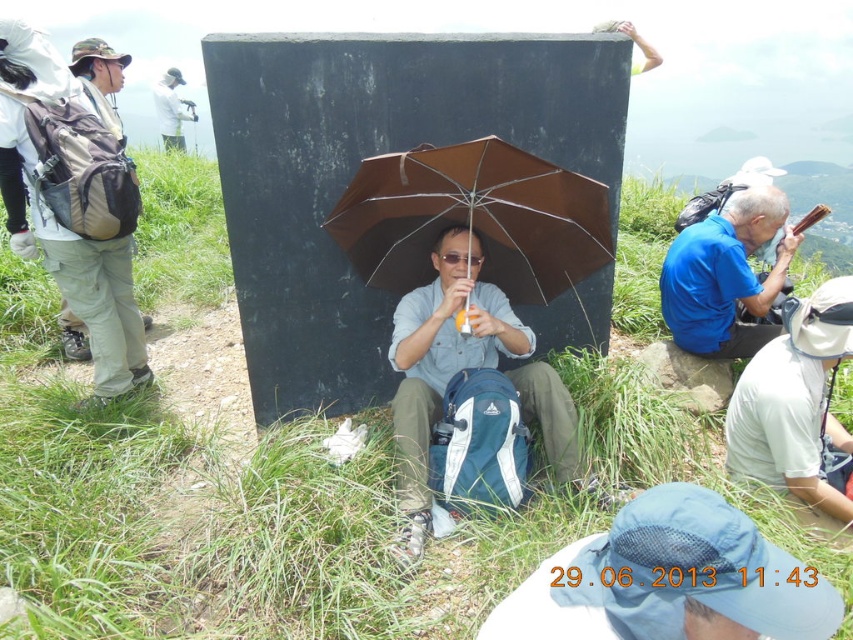
Question: Is brown matte umbrella at center thinner than white fabric camera at upper left?

Choices:
 (A) no
 (B) yes

Answer: (A)

Question: Which point is closer to the camera taking this photo?

Choices:
 (A) (419, 388)
 (B) (172, 138)

Answer: (A)

Question: Can you confirm if brown matte umbrella at center is wider than white fabric camera at upper left?

Choices:
 (A) yes
 (B) no

Answer: (A)

Question: Considering the real-world distances, which object is farthest from the white fabric hat at lower right?

Choices:
 (A) matte blue backpack at center
 (B) white fabric camera at upper left
 (C) blue fabric shirt at center
 (D) brown matte umbrella at center

Answer: (B)

Question: Is matte blue backpack at center to the left of blue fabric shirt at center from the viewer's perspective?

Choices:
 (A) yes
 (B) no

Answer: (A)

Question: Based on their relative distances, which object is farther from the white fabric camera at upper left?

Choices:
 (A) white fabric hat at lower right
 (B) brown matte umbrella at center
 (C) blue fabric shirt at center
 (D) matte blue backpack at center

Answer: (A)